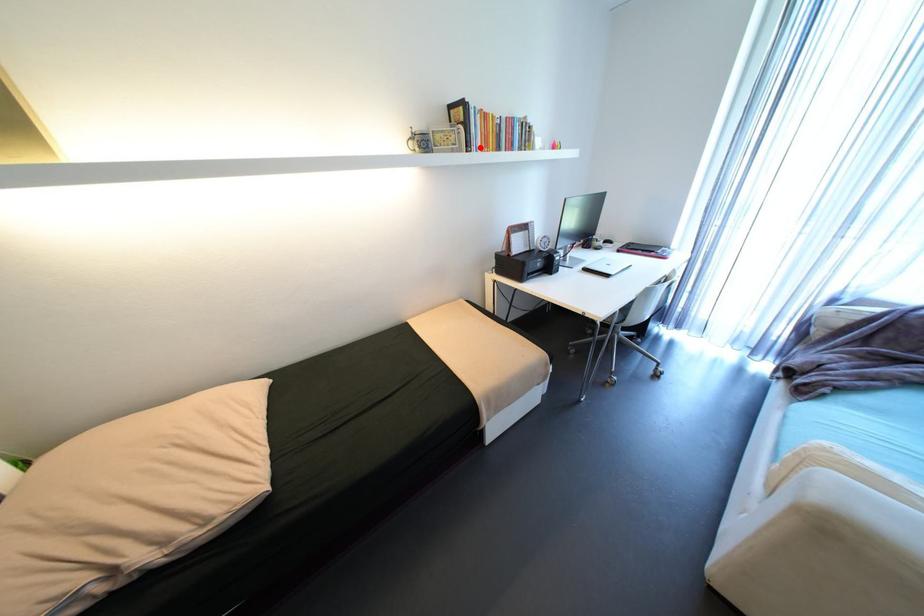
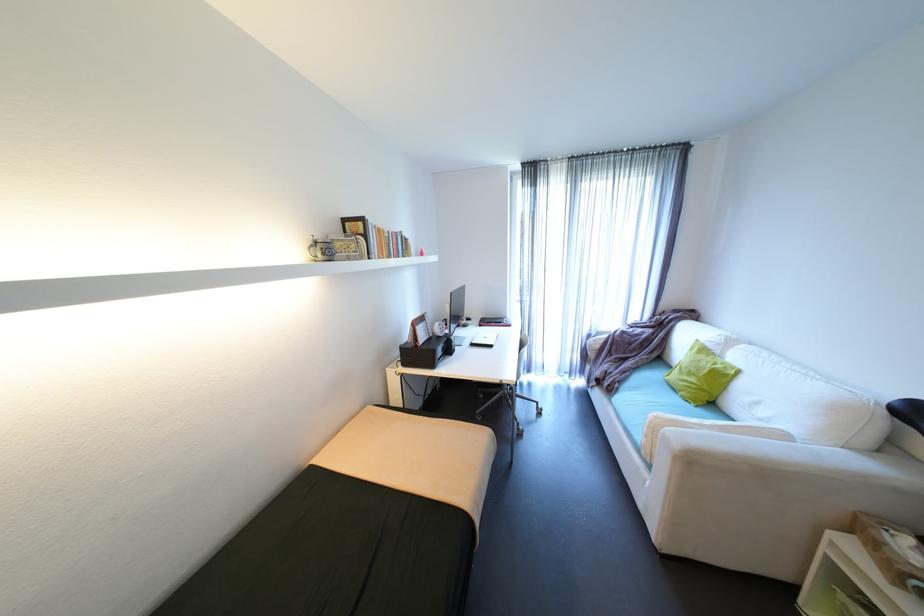
Locate, in the second image, the point that corresponds to the highlighted location in the first image.

(380, 254)